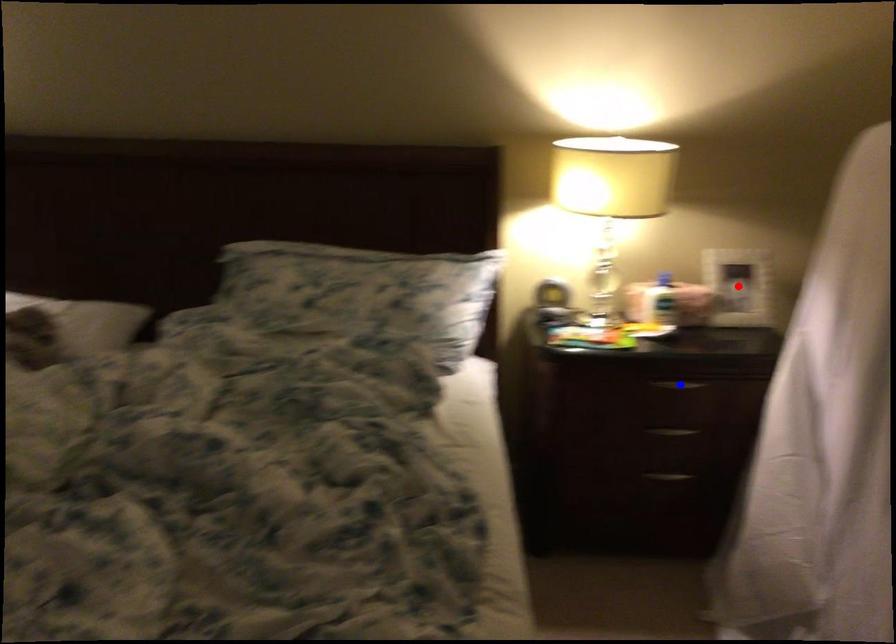
Question: Which of the two points in the image is closer to the camera?

Choices:
 (A) Blue point is closer.
 (B) Red point is closer.

Answer: (A)